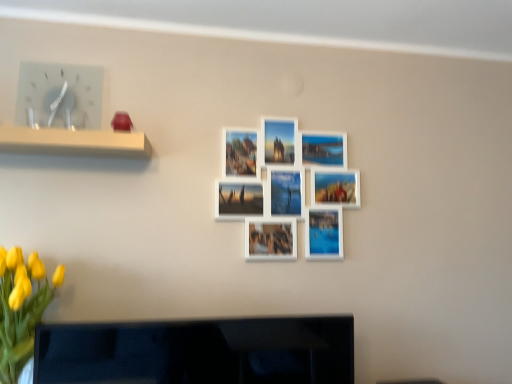
In order to face white plastic clock at upper left, should I rotate leftwards or rightwards?

A 24.707 degree turn to the left will do.

Identify the location of yellow matte flowers at lower left. Image resolution: width=512 pixels, height=384 pixels. (21, 308).

Can you confirm if black glossy tv at lower center is positioned to the left of white plastic clock at upper left?

Incorrect, black glossy tv at lower center is not on the left side of white plastic clock at upper left.

Which is closer, (203, 350) or (73, 99)?

Point (203, 350) appears to be closer to the viewer than point (73, 99).

From the image's perspective, is black glossy tv at lower center on top of white plastic clock at upper left?

No, from the image's perspective, black glossy tv at lower center is not over white plastic clock at upper left.

Is point (135, 366) positioned behind point (274, 209)?

No, it is in front of (274, 209).

From the image's perspective, would you say black glossy tv at lower center is positioned over white glossy photo frames at center?

Answer: No, from the image's perspective, black glossy tv at lower center is not on top of white glossy photo frames at center.

Can you confirm if black glossy tv at lower center is shorter than white glossy photo frames at center?

Yes, black glossy tv at lower center is shorter than white glossy photo frames at center.

Between black glossy tv at lower center and white glossy photo frames at center, which one has larger size?

black glossy tv at lower center.

Is point (295, 257) behind point (96, 95)?

Yes, it is.

From a real-world perspective, is white glossy photo frames at center beneath white plastic clock at upper left?

Yes, from a real-world perspective, white glossy photo frames at center is under white plastic clock at upper left.

Is white glossy photo frames at center positioned far away from white plastic clock at upper left?

They are positioned close to each other.

Does white plastic clock at upper left have a smaller size compared to black glossy tv at lower center?

Indeed, white plastic clock at upper left has a smaller size compared to black glossy tv at lower center.

Looking at this image, from the image's perspective, is white plastic clock at upper left on top of black glossy tv at lower center?

Yes, from the image's perspective, white plastic clock at upper left is above black glossy tv at lower center.

From a real-world perspective, which is physically above, white plastic clock at upper left or black glossy tv at lower center?

white plastic clock at upper left, from a real-world perspective.

Is white plastic clock at upper left wider than white glossy photo frames at center?

Indeed, white plastic clock at upper left has a greater width compared to white glossy photo frames at center.

Is white glossy photo frames at center surrounded by white plastic clock at upper left?

No, white glossy photo frames at center is not a part of white plastic clock at upper left.

Is point (34, 124) farther from camera compared to point (315, 215)?

No, (34, 124) is closer to viewer.

How different are the orientations of yellow matte flowers at lower left and white glossy photo frames at center in degrees?

The angle between the facing direction of yellow matte flowers at lower left and the facing direction of white glossy photo frames at center is 1.33 degrees.

From the image's perspective, is yellow matte flowers at lower left above white glossy photo frames at center?

Actually, yellow matte flowers at lower left appears below white glossy photo frames at center in the image.

Considering the relative sizes of yellow matte flowers at lower left and white glossy photo frames at center in the image provided, is yellow matte flowers at lower left taller than white glossy photo frames at center?

In fact, yellow matte flowers at lower left may be shorter than white glossy photo frames at center.

Is yellow matte flowers at lower left completely or partially inside black glossy tv at lower center?

Definitely not — yellow matte flowers at lower left is not inside black glossy tv at lower center.

Would you say black glossy tv at lower center is a long distance from yellow matte flowers at lower left?

No.

Considering the positions of point (192, 337) and point (12, 327), is point (192, 337) closer or farther from the camera than point (12, 327)?

Point (192, 337) is farther from the camera than point (12, 327).

Locate an element on the screen. This screenshot has width=512, height=384. clock located above the black glossy tv at lower center (from a real-world perspective) is located at coordinates (x=59, y=96).

Identify the location of television below the white glossy photo frames at center (from a real-world perspective). (199, 352).

When comparing their distances from white plastic clock at upper left, does white glossy photo frames at center or black glossy tv at lower center seem closer?

The object closer to white plastic clock at upper left is white glossy photo frames at center.

Looking at the image, which one is located further to white glossy photo frames at center, black glossy tv at lower center or yellow matte flowers at lower left?

yellow matte flowers at lower left is positioned further to the anchor white glossy photo frames at center.

Looking at the image, which one is located further to white plastic clock at upper left, yellow matte flowers at lower left or white glossy photo frames at center?

white glossy photo frames at center is further to white plastic clock at upper left.

Which object lies nearer to the anchor point white glossy photo frames at center, yellow matte flowers at lower left or black glossy tv at lower center?

black glossy tv at lower center.

From the image, which object appears to be nearer to yellow matte flowers at lower left, black glossy tv at lower center or white glossy photo frames at center?

black glossy tv at lower center is closer to yellow matte flowers at lower left.

From the picture: From the image, which object appears to be nearer to white glossy photo frames at center, black glossy tv at lower center or white plastic clock at upper left?

Based on the image, black glossy tv at lower center appears to be nearer to white glossy photo frames at center.

From the picture: Which object lies nearer to the anchor point black glossy tv at lower center, white plastic clock at upper left or white glossy photo frames at center?

Based on the image, white glossy photo frames at center appears to be nearer to black glossy tv at lower center.

When comparing their distances from white glossy photo frames at center, does white plastic clock at upper left or yellow matte flowers at lower left seem closer?

white plastic clock at upper left lies closer to white glossy photo frames at center than the other object.

Locate an element on the screen. This screenshot has width=512, height=384. television between yellow matte flowers at lower left and white glossy photo frames at center in the horizontal direction is located at coordinates (199, 352).

Find the location of a particular element. television located between white plastic clock at upper left and white glossy photo frames at center in the left-right direction is located at coordinates pos(199,352).

Find the location of a particular element. The image size is (512, 384). floral arrangement located between white plastic clock at upper left and white glossy photo frames at center in the left-right direction is located at coordinates (21, 308).

I want to click on floral arrangement between white plastic clock at upper left and black glossy tv at lower center in the vertical direction, so (x=21, y=308).